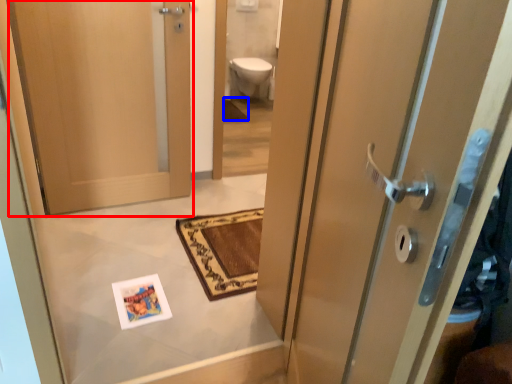
Question: Which object is further to the camera taking this photo, door (highlighted by a red box) or bath mat (highlighted by a blue box)?

Choices:
 (A) door
 (B) bath mat

Answer: (B)